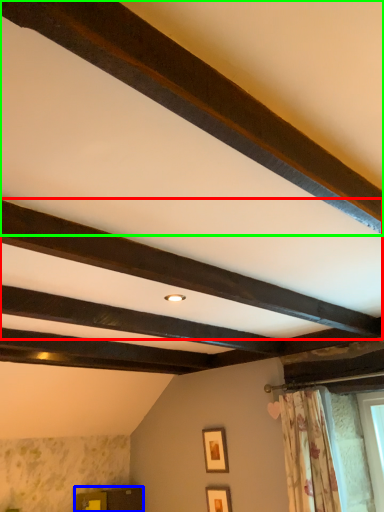
Question: Which is nearer to the plank (highlighted by a red box)? furniture (highlighted by a blue box) or plank (highlighted by a green box).

Choices:
 (A) furniture
 (B) plank

Answer: (B)